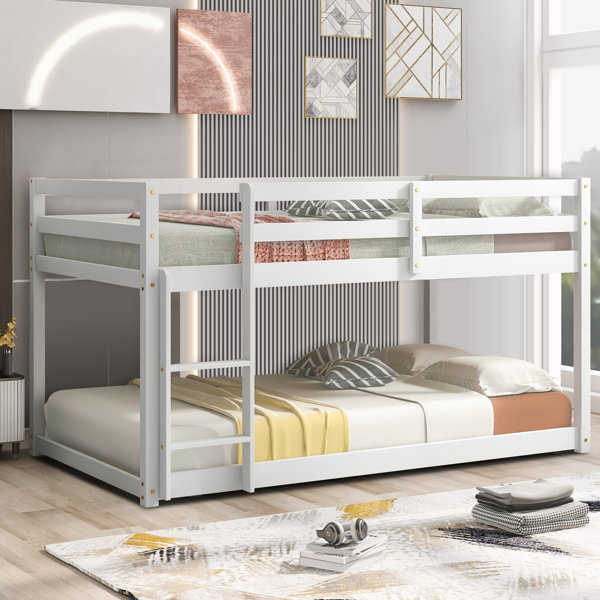
The width and height of the screenshot is (600, 600). What are the coordinates of `sheet` in the screenshot? It's located at (512, 484).